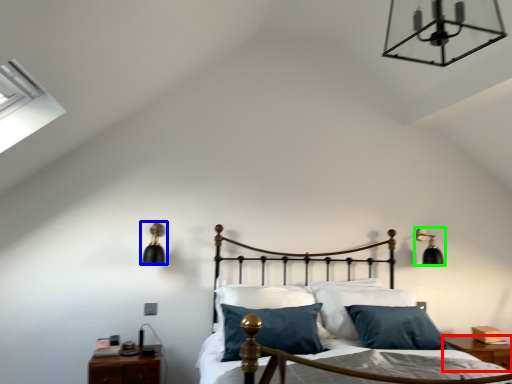
Question: Which object is positioned farthest from nightstand (highlighted by a red box)? Select from lamp (highlighted by a blue box) and lamp (highlighted by a green box).

Choices:
 (A) lamp
 (B) lamp

Answer: (A)